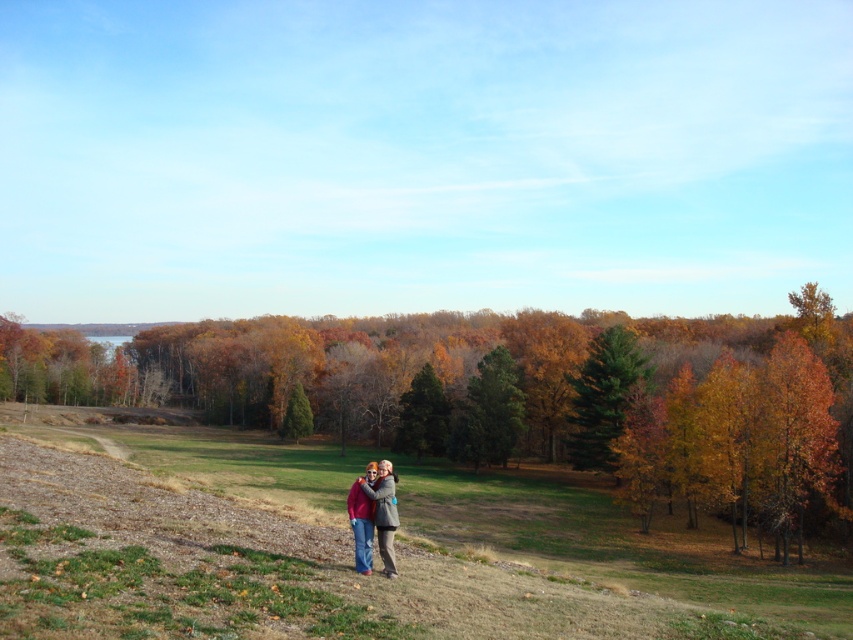
Between brown matte tree at center and green matte tree at center-right, which one is positioned higher?

Positioned higher is brown matte tree at center.

Between brown matte tree at center and green matte tree at center-right, which one appears on the left side from the viewer's perspective?

Positioned to the left is brown matte tree at center.

I want to click on brown matte tree at center, so click(531, 396).

Identify the location of green matte tree at center-right. (602, 396).

Who is more forward, [624,406] or [503,416]?

Point [624,406] is more forward.

The height and width of the screenshot is (640, 853). Identify the location of green matte tree at center-right. (602, 396).

Can you confirm if green matte tree at center-right is bigger than matte pink sweater at center?

Yes.

Describe the element at coordinates (602, 396) in the screenshot. I see `green matte tree at center-right` at that location.

You are a GUI agent. You are given a task and a screenshot of the screen. Output one action in this format:
    pyautogui.click(x=<x>, y=<y>)
    Task: Click on the green matte tree at center-right
    This screenshot has width=853, height=640.
    Given the screenshot: What is the action you would take?
    pyautogui.click(x=602, y=396)

Locate an element on the screen. This screenshot has height=640, width=853. green matte tree at center-right is located at coordinates (602, 396).